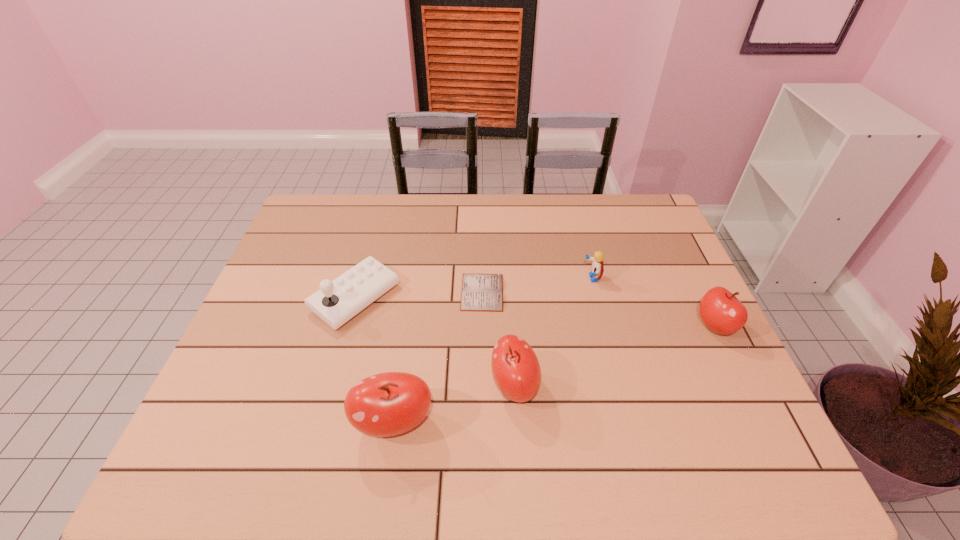
Where is `unoccupied area between the diary and the second apple from left to right`? unoccupied area between the diary and the second apple from left to right is located at coordinates (498, 339).

I want to click on vacant area that lies between the second tallest apple and the farthest apple, so click(x=614, y=356).

Find the location of a particular element. The height and width of the screenshot is (540, 960). vacant space that is in between the diary and the leftmost apple is located at coordinates (438, 357).

This screenshot has height=540, width=960. What are the coordinates of `free space between the farthest apple and the fifth object from left to right` in the screenshot? It's located at (653, 302).

Locate an element on the screen. the closest object relative to the second shortest object is located at coordinates (721, 311).

Locate an element on the screen. The height and width of the screenshot is (540, 960). object that is the closest to the Lego is located at coordinates click(721, 311).

This screenshot has height=540, width=960. In order to click on apple that stands as the second closest to the fifth shortest object in this screenshot , I will do `click(721, 311)`.

What are the coordinates of `the second closest apple relative to the joystick` in the screenshot? It's located at (516, 369).

Find the location of a particular element. The image size is (960, 540). free location that satisfies the following two spatial constraints: 1. on the front-facing side of the rightmost apple; 2. on the left side of the fifth tallest object is located at coordinates (605, 326).

Where is `free space that satisfies the following two spatial constraints: 1. on the front side of the joystick; 2. on the right side of the leftmost apple`? The height and width of the screenshot is (540, 960). free space that satisfies the following two spatial constraints: 1. on the front side of the joystick; 2. on the right side of the leftmost apple is located at coordinates (321, 422).